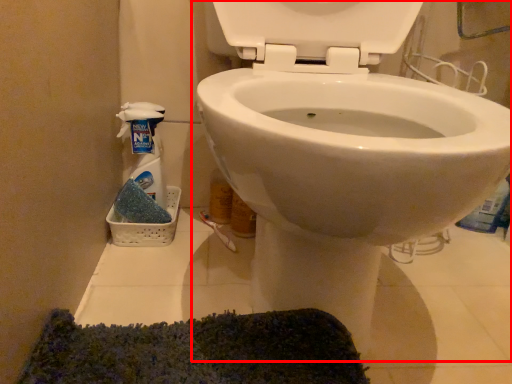
Question: From the image's perspective, what is the correct spatial relationship of toilet (annotated by the red box) in relation to cleaning product?

Choices:
 (A) above
 (B) below

Answer: (A)